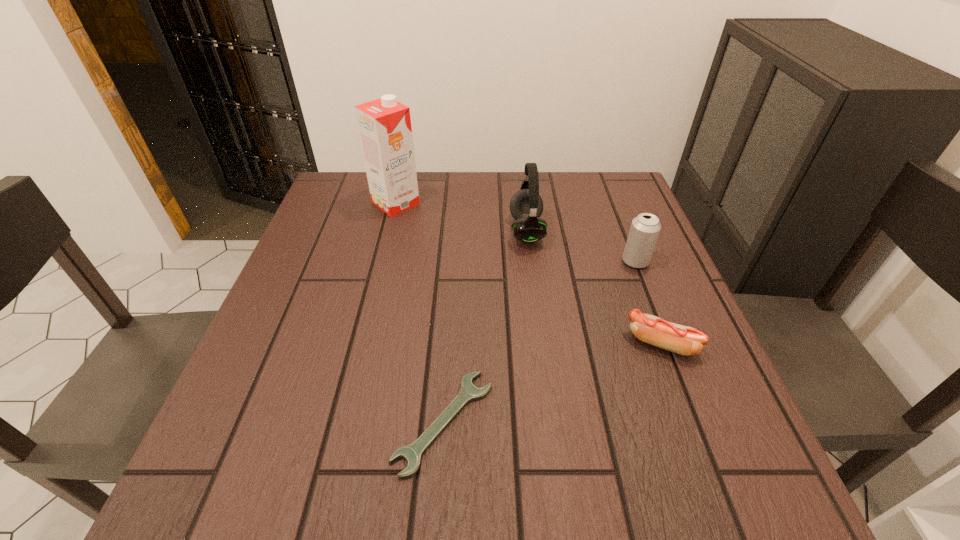
Where is `object identified as the closest to the third object from left to right`? object identified as the closest to the third object from left to right is located at coordinates (645, 228).

Locate which object ranks second in proximity to the third object from left to right. Please provide its 2D coordinates. Your answer should be formatted as a tuple, i.e. [(x, y)], where the tuple contains the x and y coordinates of a point satisfying the conditions above.

[(384, 125)]

Where is `blank area in the image that satisfies the following two spatial constraints: 1. on the back side of the sausage; 2. on the right side of the second object from left to right`? This screenshot has width=960, height=540. blank area in the image that satisfies the following two spatial constraints: 1. on the back side of the sausage; 2. on the right side of the second object from left to right is located at coordinates (449, 344).

At what (x,y) coordinates should I click in order to perform the action: click on free point that satisfies the following two spatial constraints: 1. on the front side of the sausage; 2. on the right side of the leftmost object. Please return your answer as a coordinate pair (x, y). The width and height of the screenshot is (960, 540). Looking at the image, I should click on (361, 344).

The width and height of the screenshot is (960, 540). I want to click on free space that satisfies the following two spatial constraints: 1. on the ear cups of the second tallest object; 2. on the right side of the sausage, so click(540, 344).

You are a GUI agent. You are given a task and a screenshot of the screen. Output one action in this format:
    pyautogui.click(x=<x>, y=<y>)
    Task: Click on the free space that satisfies the following two spatial constraints: 1. on the back side of the third nearest object; 2. on the ear cups of the headset
    
    Given the screenshot: What is the action you would take?
    pyautogui.click(x=623, y=231)